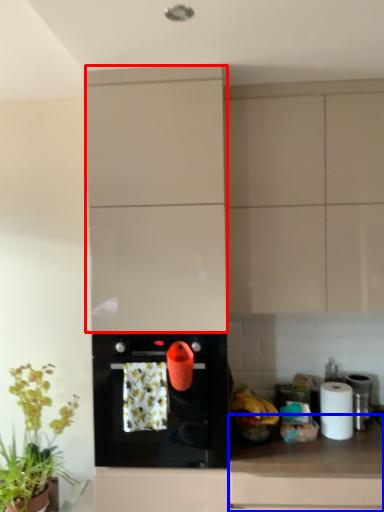
Question: Which point is further to the camera, cabinetry (highlighted by a red box) or countertop (highlighted by a blue box)?

Choices:
 (A) cabinetry
 (B) countertop

Answer: (A)